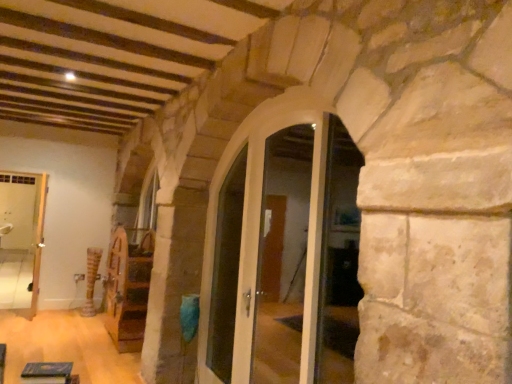
Question: Considering the relative positions of green felt book at lower left, which ranks as the first furniture in top-to-bottom order, and white glossy door at center in the image provided, is green felt book at lower left, which ranks as the first furniture in top-to-bottom order, to the left of white glossy door at center from the viewer's perspective?

Choices:
 (A) no
 (B) yes

Answer: (B)

Question: Does green felt book at lower left, the second furniture when ordered from back to front, contain white glossy door at center?

Choices:
 (A) yes
 (B) no

Answer: (B)

Question: Can you confirm if green felt book at lower left, which ranks as the first furniture in top-to-bottom order, is taller than white glossy door at center?

Choices:
 (A) yes
 (B) no

Answer: (B)

Question: Considering the relative sizes of green felt book at lower left, the first furniture positioned from the front, and white glossy door at center in the image provided, is green felt book at lower left, the first furniture positioned from the front, bigger than white glossy door at center?

Choices:
 (A) yes
 (B) no

Answer: (B)

Question: Considering the relative sizes of green felt book at lower left, the first furniture positioned from the front, and white glossy door at center in the image provided, is green felt book at lower left, the first furniture positioned from the front, thinner than white glossy door at center?

Choices:
 (A) no
 (B) yes

Answer: (A)

Question: From a real-world perspective, is green felt book at lower left, which ranks as the first furniture in top-to-bottom order, located higher than white glossy door at center?

Choices:
 (A) yes
 (B) no

Answer: (B)

Question: Is clear glass door at center, which appears as the 1th glass door when viewed from the front, shorter than white glossy door at center?

Choices:
 (A) yes
 (B) no

Answer: (B)

Question: Can you confirm if clear glass door at center, which appears as the 1th glass door when viewed from the front, is positioned to the left of white glossy door at center?

Choices:
 (A) no
 (B) yes

Answer: (A)

Question: From the image's perspective, is clear glass door at center, which appears as the 1th glass door when viewed from the front, beneath white glossy door at center?

Choices:
 (A) yes
 (B) no

Answer: (A)

Question: Considering the relative positions of clear glass door at center, which appears as the 1th glass door when viewed from the front, and white glossy door at center in the image provided, is clear glass door at center, which appears as the 1th glass door when viewed from the front, to the right of white glossy door at center from the viewer's perspective?

Choices:
 (A) yes
 (B) no

Answer: (A)

Question: From a real-world perspective, is clear glass door at center, which appears as the 1th glass door when viewed from the front, positioned over white glossy door at center based on gravity?

Choices:
 (A) yes
 (B) no

Answer: (B)

Question: Considering the relative sizes of clear glass door at center, which ranks as the second glass door in back-to-front order, and white glossy door at center in the image provided, is clear glass door at center, which ranks as the second glass door in back-to-front order, bigger than white glossy door at center?

Choices:
 (A) yes
 (B) no

Answer: (A)

Question: From a real-world perspective, is white glossy door at center, marked as the 2th glass door in a front-to-back arrangement, physically above clear glass door at center, which ranks as the second glass door in back-to-front order?

Choices:
 (A) no
 (B) yes

Answer: (B)